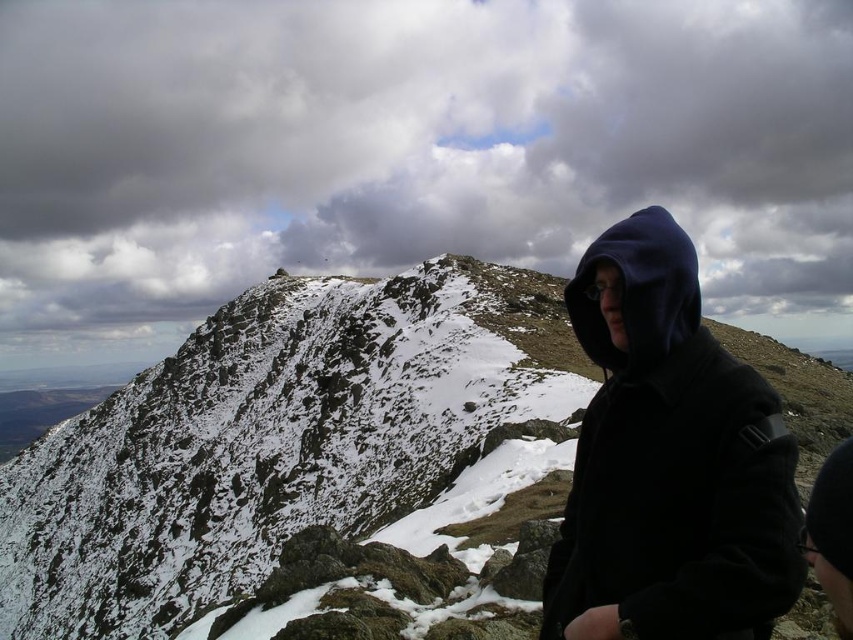
You are standing at the base of the snowy rocky mountain at upper center and want to reach the summit. The path is steep and rocky. Your GPS indicates that the summit is 155.42 feet away. If you can climb 20 feet per minute, how many minutes will it take you to reach the summit?

The distance to the summit is 155.42 feet, and climbing at 20 feet per minute, it would take approximately 7.77 minutes. Since you can climb 20 feet per minute, dividing 155.42 by 20 gives roughly 7.77 minutes.